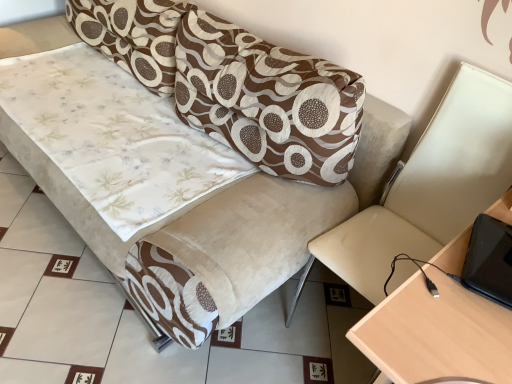
The image size is (512, 384). What do you see at coordinates (428, 188) in the screenshot?
I see `beige leather swivel chair at right` at bounding box center [428, 188].

What do you see at coordinates (437, 334) in the screenshot? The height and width of the screenshot is (384, 512). I see `light wood table at right` at bounding box center [437, 334].

Where is `velvet-like beige couch at center`? This screenshot has width=512, height=384. velvet-like beige couch at center is located at coordinates (263, 226).

Is velvet-like beige couch at center wider than brown textured pillow at upper center?

Indeed, velvet-like beige couch at center has a greater width compared to brown textured pillow at upper center.

Could you tell me if velvet-like beige couch at center is facing brown textured pillow at upper center?

No, velvet-like beige couch at center does not turn towards brown textured pillow at upper center.

Which object is more forward, velvet-like beige couch at center or brown textured pillow at upper center?

velvet-like beige couch at center is more forward.

In the scene shown: Considering the positions of objects velvet-like beige couch at center and brown textured pillow at upper center in the image provided, who is more to the left, velvet-like beige couch at center or brown textured pillow at upper center?

From the viewer's perspective, velvet-like beige couch at center appears more on the left side.

Does beige leather swivel chair at right have a lesser height compared to light wood table at right?

No.

Does beige leather swivel chair at right turn towards light wood table at right?

No, beige leather swivel chair at right is not turned towards light wood table at right.

Is beige leather swivel chair at right in front of light wood table at right?

No, beige leather swivel chair at right is further to the viewer.

Consider the image. How far apart are beige leather swivel chair at right and light wood table at right?

beige leather swivel chair at right and light wood table at right are 16.01 inches apart.

Which of these two, velvet-like beige couch at center or light wood table at right, is wider?

velvet-like beige couch at center is wider.

Where is `studio couch located above the light wood table at right (from the image's perspective)`? The height and width of the screenshot is (384, 512). studio couch located above the light wood table at right (from the image's perspective) is located at coordinates (263, 226).

Is velvet-like beige couch at center in front of light wood table at right?

No, it is behind light wood table at right.

From the image's perspective, is velvet-like beige couch at center below light wood table at right?

Incorrect, from the image's perspective, velvet-like beige couch at center is higher than light wood table at right.

Which object is closer to the camera, light wood table at right or velvet-like beige couch at center?

light wood table at right is closer to the camera.

Are light wood table at right and velvet-like beige couch at center making contact?

No, light wood table at right is not beside velvet-like beige couch at center.

Which is farther, (421,282) or (258,206)?

Point (258,206)

Who is bigger, light wood table at right or velvet-like beige couch at center?

Bigger between the two is velvet-like beige couch at center.

Is light wood table at right bigger than beige leather swivel chair at right?

Correct, light wood table at right is larger in size than beige leather swivel chair at right.

Considering the relative sizes of light wood table at right and beige leather swivel chair at right in the image provided, is light wood table at right shorter than beige leather swivel chair at right?

Indeed, light wood table at right has a lesser height compared to beige leather swivel chair at right.

Looking at this image, how distant is light wood table at right from beige leather swivel chair at right?

The distance of light wood table at right from beige leather swivel chair at right is 16.01 inches.

Is point (415, 323) closer to camera compared to point (500, 167)?

Yes, point (415, 323) is closer to viewer.

Is light wood table at right turned away from brown textured pillow at upper center?

No.

Could brown textured pillow at upper center be considered to be inside light wood table at right?

No, light wood table at right does not contain brown textured pillow at upper center.

Can you confirm if light wood table at right is positioned to the left of brown textured pillow at upper center?

In fact, light wood table at right is to the right of brown textured pillow at upper center.

Between light wood table at right and brown textured pillow at upper center, which one has smaller width?

Thinner between the two is brown textured pillow at upper center.

Can you see velvet-like beige couch at center touching beige leather swivel chair at right?

They are not placed beside each other.

In terms of size, does velvet-like beige couch at center appear bigger or smaller than beige leather swivel chair at right?

velvet-like beige couch at center is bigger than beige leather swivel chair at right.

From a real-world perspective, who is located higher, velvet-like beige couch at center or beige leather swivel chair at right?

beige leather swivel chair at right.

Can we say velvet-like beige couch at center lies outside beige leather swivel chair at right?

Absolutely, velvet-like beige couch at center is external to beige leather swivel chair at right.

The height and width of the screenshot is (384, 512). I want to click on pillow above the velvet-like beige couch at center (from the image's perspective), so click(267, 100).

You are a GUI agent. You are given a task and a screenshot of the screen. Output one action in this format:
    pyautogui.click(x=<x>, y=<y>)
    Task: Click on the table below the beige leather swivel chair at right (from a real-world perspective)
    The height and width of the screenshot is (384, 512).
    Given the screenshot: What is the action you would take?
    pyautogui.click(x=437, y=334)

Looking at this image, estimate the real-world distances between objects in this image. Which object is further from brown textured pillow at upper center, light wood table at right or velvet-like beige couch at center?

light wood table at right.

Considering their positions, is beige leather swivel chair at right positioned closer to velvet-like beige couch at center than brown textured pillow at upper center?

Among the two, beige leather swivel chair at right is located nearer to velvet-like beige couch at center.

Considering their positions, is velvet-like beige couch at center positioned closer to brown textured pillow at upper center than beige leather swivel chair at right?

velvet-like beige couch at center lies closer to brown textured pillow at upper center than the other object.

Estimate the real-world distances between objects in this image. Which object is further from light wood table at right, brown textured pillow at upper center or beige leather swivel chair at right?

Based on the image, brown textured pillow at upper center appears to be further to light wood table at right.

From the image, which object appears to be nearer to light wood table at right, velvet-like beige couch at center or beige leather swivel chair at right?

Based on the image, beige leather swivel chair at right appears to be nearer to light wood table at right.

Estimate the real-world distances between objects in this image. Which object is closer to brown textured pillow at upper center, beige leather swivel chair at right or velvet-like beige couch at center?

velvet-like beige couch at center lies closer to brown textured pillow at upper center than the other object.

Looking at the image, which one is located closer to beige leather swivel chair at right, velvet-like beige couch at center or light wood table at right?

velvet-like beige couch at center lies closer to beige leather swivel chair at right than the other object.

Which object lies further to the anchor point light wood table at right, velvet-like beige couch at center or brown textured pillow at upper center?

Based on the image, brown textured pillow at upper center appears to be further to light wood table at right.

This screenshot has height=384, width=512. Identify the location of pillow situated between velvet-like beige couch at center and beige leather swivel chair at right from left to right. (267, 100).

Image resolution: width=512 pixels, height=384 pixels. Find the location of `swivel chair situated between velvet-like beige couch at center and light wood table at right from left to right`. swivel chair situated between velvet-like beige couch at center and light wood table at right from left to right is located at coordinates (428, 188).

Locate an element on the screen. swivel chair between brown textured pillow at upper center and light wood table at right in the up-down direction is located at coordinates (428, 188).

Where is `pillow between velvet-like beige couch at center and light wood table at right`? This screenshot has width=512, height=384. pillow between velvet-like beige couch at center and light wood table at right is located at coordinates (x=267, y=100).